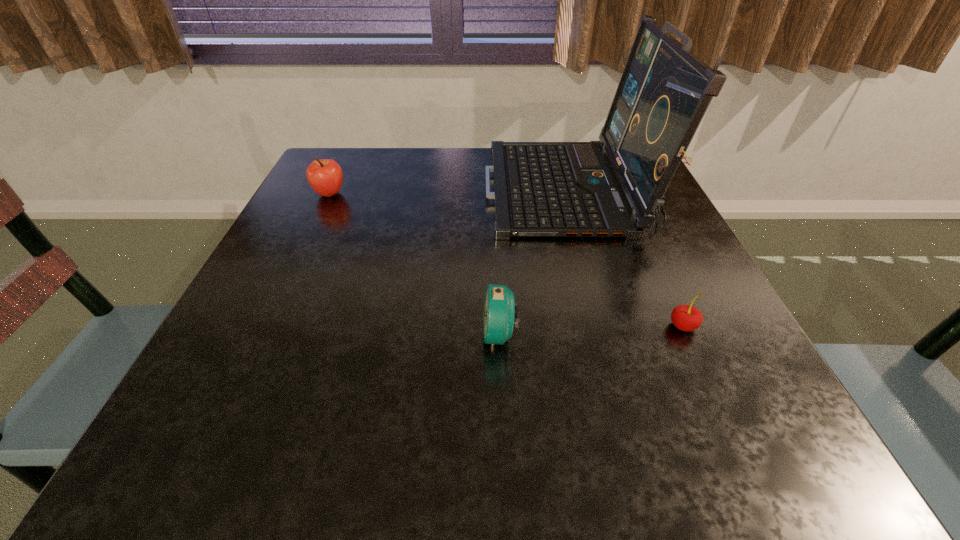
The height and width of the screenshot is (540, 960). I want to click on vacant region located 0.140m on the front of the leftmost object, so click(x=307, y=240).

This screenshot has width=960, height=540. I want to click on vacant space located 0.280m on the left of the cherry, so click(497, 326).

This screenshot has height=540, width=960. I want to click on laptop computer at the far edge, so click(x=541, y=189).

This screenshot has height=540, width=960. What are the coordinates of `apple that is at the far edge` in the screenshot? It's located at (325, 176).

This screenshot has width=960, height=540. I want to click on object located in the left edge section of the desktop, so click(x=325, y=176).

I want to click on laptop computer that is at the right edge, so click(x=541, y=189).

Locate an element on the screen. The height and width of the screenshot is (540, 960). cherry that is positioned at the right edge is located at coordinates click(x=687, y=318).

Identify the location of object that is at the far left corner. (325, 176).

Locate an element on the screen. The height and width of the screenshot is (540, 960). object located at the far right corner is located at coordinates (541, 189).

The width and height of the screenshot is (960, 540). Identify the location of free spot at the far edge of the desktop. (434, 177).